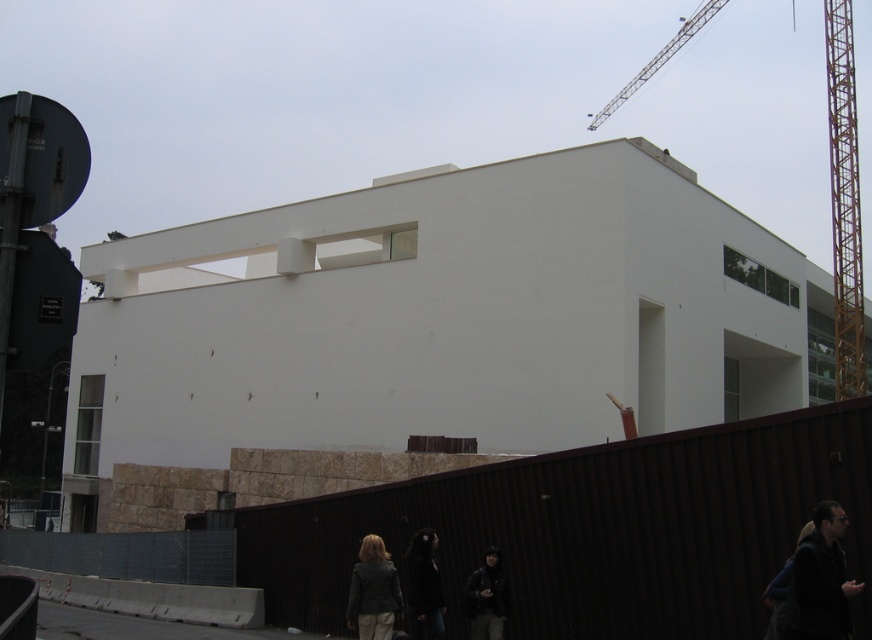
Is matte gray jacket at lower center to the left of dark gray jacket at lower center from the viewer's perspective?

Yes, matte gray jacket at lower center is to the left of dark gray jacket at lower center.

Does matte gray jacket at lower center appear under dark gray jacket at lower center?

No, matte gray jacket at lower center is not below dark gray jacket at lower center.

Is point (377, 580) positioned after point (494, 582)?

That is False.

Identify the location of matte gray jacket at lower center. (373, 592).

Can you confirm if brown corrugated metal fence at lower center is wider than dark gray jacket at lower right?

Correct, the width of brown corrugated metal fence at lower center exceeds that of dark gray jacket at lower right.

Between brown corrugated metal fence at lower center and dark gray jacket at lower right, which one appears on the left side from the viewer's perspective?

From the viewer's perspective, brown corrugated metal fence at lower center appears more on the left side.

Does point (713, 536) come behind point (823, 608)?

That is True.

In order to click on brown corrugated metal fence at lower center in this screenshot , I will do coord(594,529).

Who is positioned more to the right, brown corrugated metal fence at lower center or dark gray jacket at lower center?

dark gray jacket at lower center is more to the right.

Does brown corrugated metal fence at lower center have a lesser height compared to dark gray jacket at lower center?

No, brown corrugated metal fence at lower center is not shorter than dark gray jacket at lower center.

Image resolution: width=872 pixels, height=640 pixels. I want to click on brown corrugated metal fence at lower center, so click(594, 529).